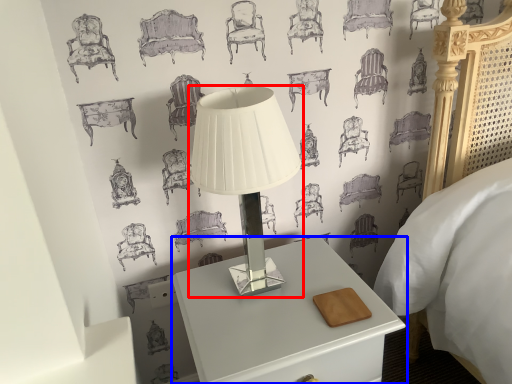
Question: Which object is closer to the camera taking this photo, lamp (highlighted by a red box) or nightstand (highlighted by a blue box)?

Choices:
 (A) lamp
 (B) nightstand

Answer: (A)